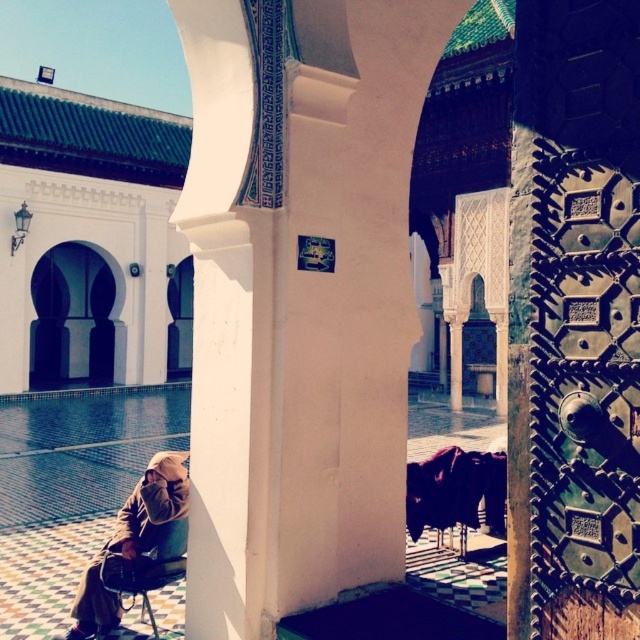
You are standing in the courtyard and want to see the person in the brown suede robe at lower left. Is the white stone archway at left blocking your view of them?

A: The brown suede robe at lower left has a lesser height compared to white stone archway at left, so the archway is taller and might block the view unless you move closer or adjust your angle.

You are an interior designer planning to place a 1.2 meter wide decorative rug in this space. You see the brown suede robe at lower left and the white stone archway at left. Which object has a smaller width that would allow the rug to fit alongside it without overlapping?

The brown suede robe at lower left has a smaller width than the white stone archway at left, so the rug can be placed next to it without overlapping.